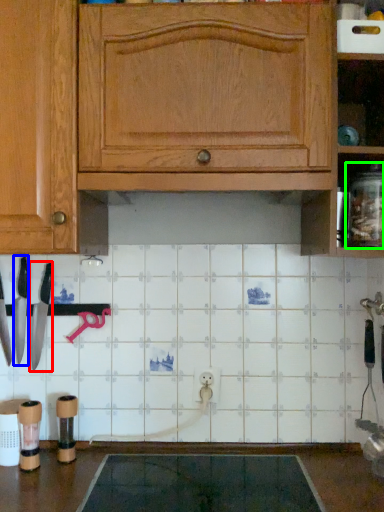
Question: Which is farther away from knife (highlighted by a red box)? knife (highlighted by a blue box) or glass jar (highlighted by a green box)?

Choices:
 (A) knife
 (B) glass jar

Answer: (B)